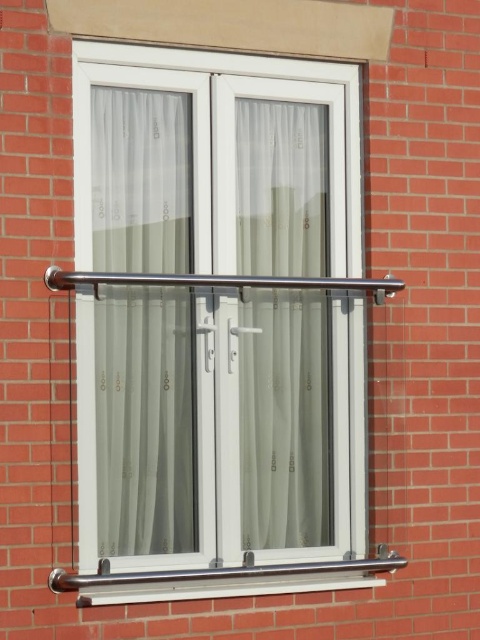
You are standing in front of the building and want to enter through the white plastic glass door at center. Based on the coordinates provided, where exactly should you walk to find the door?

The white plastic glass door at center is located at coordinates point (218, 426), so you should walk to that specific point to find the door.

You are standing in front of the building described in the scene. There is a point marked at coordinates (218, 426). Which object does this point correspond to?

The point at coordinates (218, 426) corresponds to the white plastic glass door at center.

You are an interior designer assessing the window setup. The translucent fabric curtain at center and the white plastic window sill at lower center are both part of the design. Which object is narrower in width?

The translucent fabric curtain at center has a lesser width compared to the white plastic window sill at lower center, so the translucent fabric curtain at center is narrower in width.